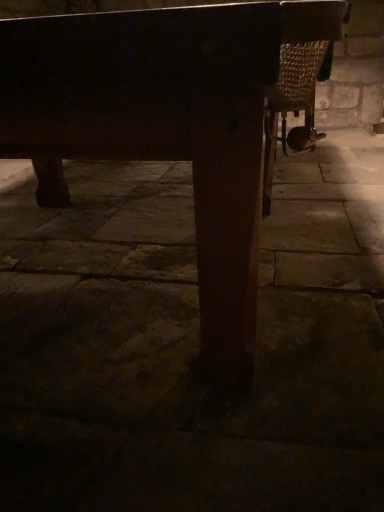
Locate an element on the screen. The width and height of the screenshot is (384, 512). rustic wood table at center is located at coordinates (164, 125).

This screenshot has width=384, height=512. What do you see at coordinates (164, 125) in the screenshot?
I see `rustic wood table at center` at bounding box center [164, 125].

Find the location of a particular element. rustic wood table at center is located at coordinates (164, 125).